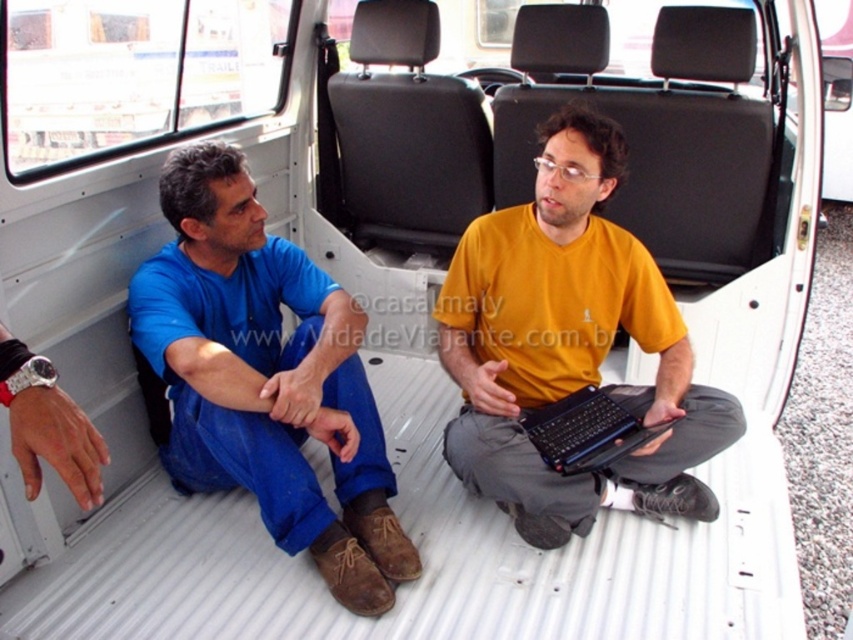
You need to place a rectangular box that is 1.2 meters wide on the floor of the van. Given the blue denim jeans at lower left and the black plastic laptop at center are both on the floor, which object should you move to make space?

The blue denim jeans at lower left should be moved because its width is larger than the black plastic laptop at center, meaning it occupies more space on the floor.